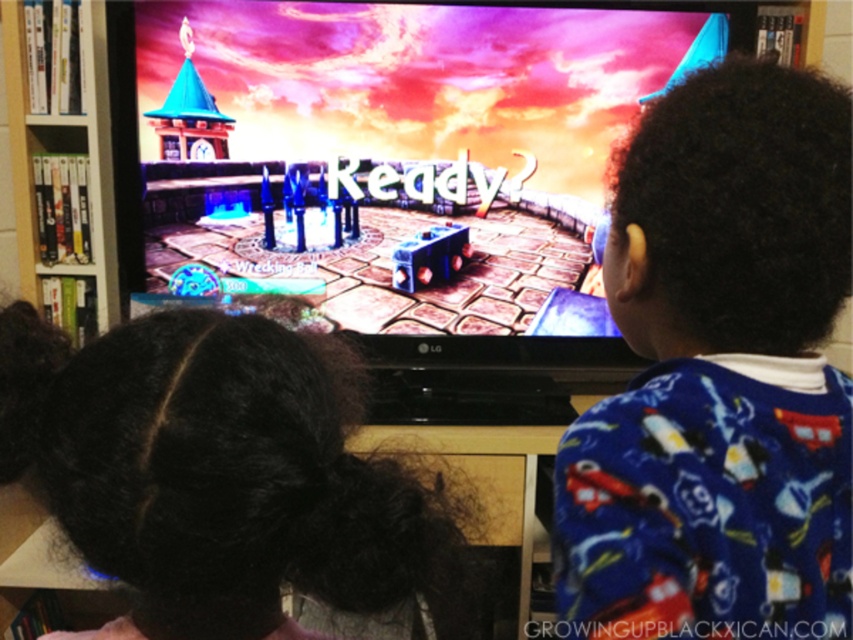
Is blue fleece pajamas at right shorter than black curly hair at lower left?

In fact, blue fleece pajamas at right may be taller than black curly hair at lower left.

Which is more to the left, blue fleece pajamas at right or black curly hair at lower left?

From the viewer's perspective, black curly hair at lower left appears more on the left side.

Does point (759, 237) lie in front of point (293, 403)?

No, it is behind (293, 403).

At what (x,y) coordinates should I click in order to perform the action: click on blue fleece pajamas at right. Please return your answer as a coordinate pair (x, y). Looking at the image, I should click on (718, 372).

In the scene shown: Is blue fleece pajamas at right below white glossy bookshelf at left?

Yes.

Find the location of a particular element. blue fleece pajamas at right is located at coordinates (718, 372).

Locate an element on the screen. The height and width of the screenshot is (640, 853). blue fleece pajamas at right is located at coordinates 718,372.

Who is more distant from viewer, [248,548] or [13,136]?

The point [13,136] is more distant.

Does point (93, 412) come farther from viewer compared to point (105, 61)?

No.

Is point (213, 561) positioned before point (18, 83)?

Yes.

Identify the location of black curly hair at lower left. (236, 481).